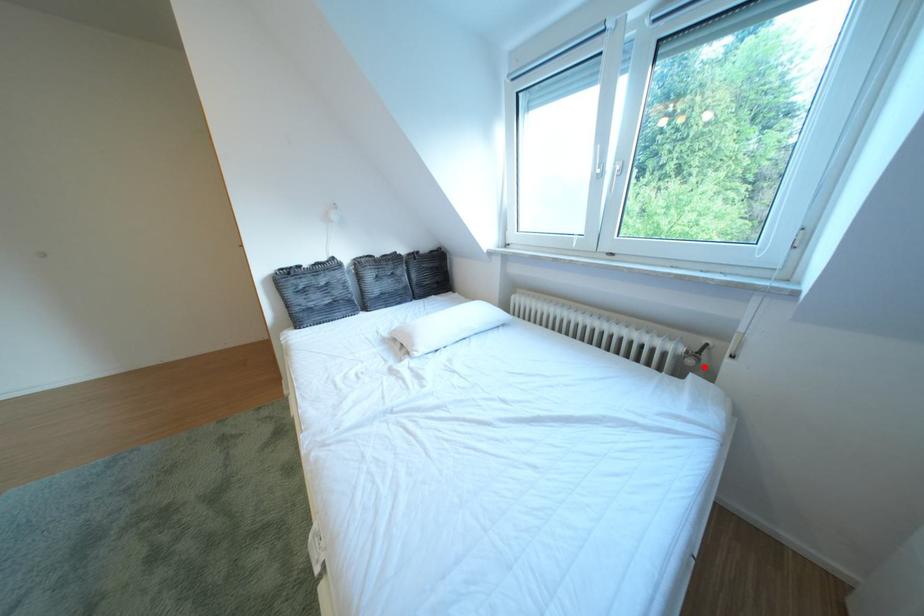
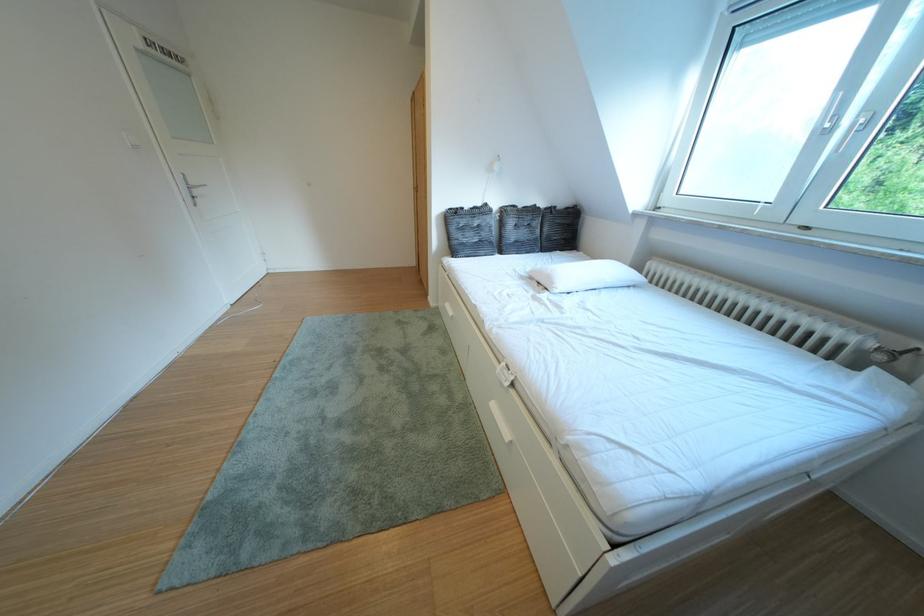
In the second image, find the point that corresponds to the highlighted location in the first image.

(893, 363)